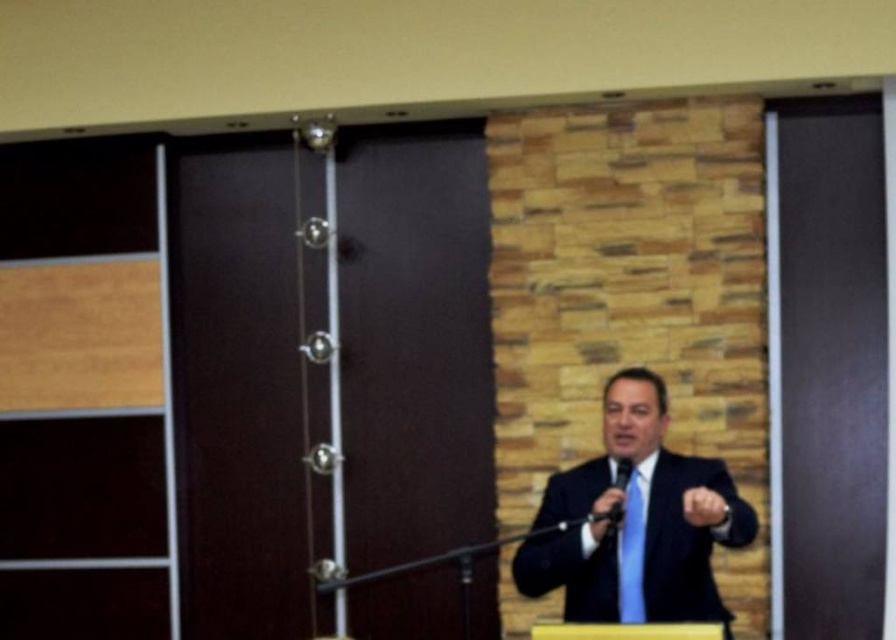
Question: Can you confirm if matte black suit at center is wider than blue silk tie at center?

Choices:
 (A) no
 (B) yes

Answer: (B)

Question: Does matte black suit at center have a lesser width compared to blue silk tie at center?

Choices:
 (A) yes
 (B) no

Answer: (B)

Question: Among these points, which one is nearest to the camera?

Choices:
 (A) (623, 376)
 (B) (619, 582)

Answer: (B)

Question: Is matte black suit at center smaller than blue silk tie at center?

Choices:
 (A) yes
 (B) no

Answer: (B)

Question: Which point is farther from the camera taking this photo?

Choices:
 (A) (597, 604)
 (B) (639, 621)

Answer: (A)